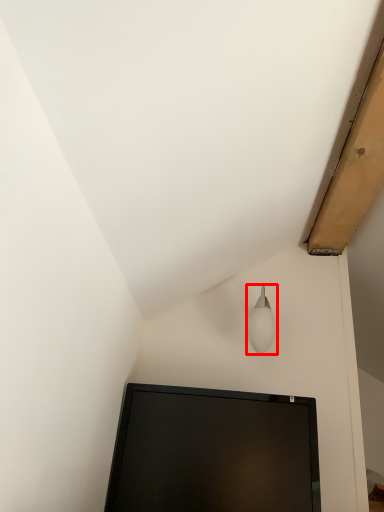
Question: From the image's perspective, where is lamp (annotated by the red box) located in relation to computer monitor in the image?

Choices:
 (A) above
 (B) below

Answer: (A)